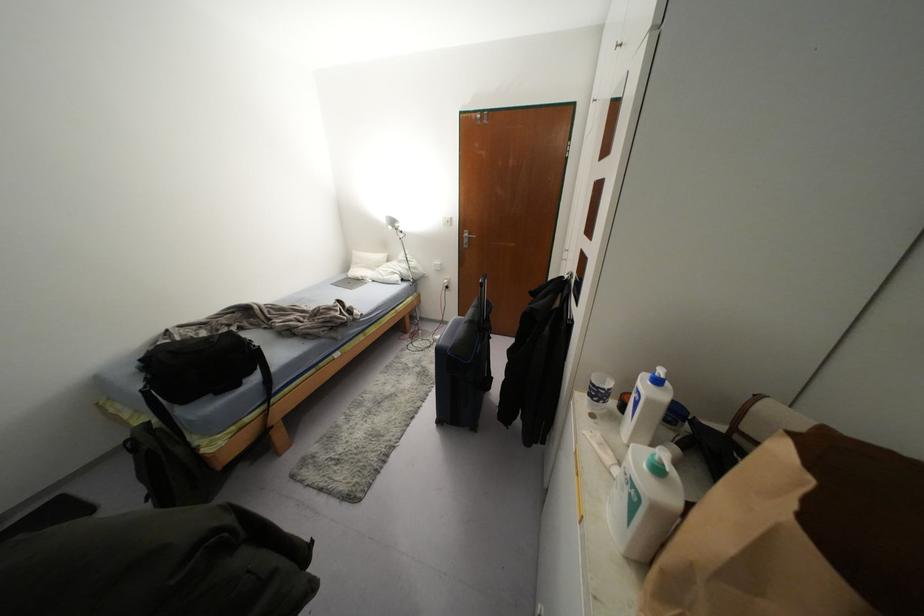
Find where to adjust the desk lamp head. Please return your answer as a coordinate pair (x, y).

(392, 223)